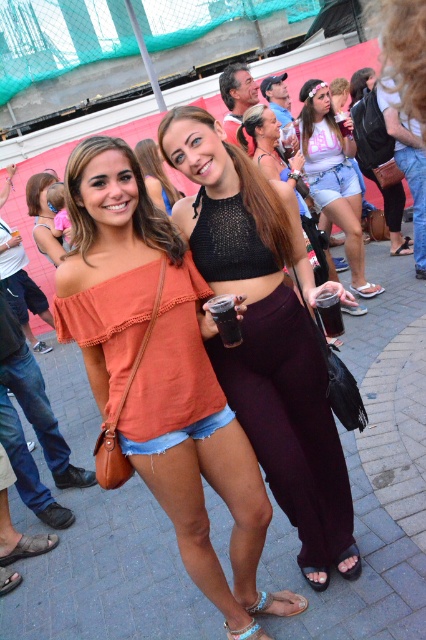
Question: Which of the following is the farthest from the observer?

Choices:
 (A) leather sandal at lower center
 (B) black mesh bikini top at center

Answer: (A)

Question: Which point is closer to the camera taking this photo?

Choices:
 (A) click(285, 609)
 (B) click(336, 170)

Answer: (A)

Question: Is matte black top at center bigger than black plastic cup at center?

Choices:
 (A) no
 (B) yes

Answer: (B)

Question: Is black mesh bikini top at center wider than leather sandal at lower center?

Choices:
 (A) yes
 (B) no

Answer: (A)

Question: Estimate the real-world distances between objects in this image. Which object is closer to the matte black top at center?

Choices:
 (A) dark matte glass at center
 (B) matte black top at upper left
 (C) orange cotton top at center

Answer: (B)

Question: Does matte black top at center appear on the left side of blue fabric sandal at lower center?

Choices:
 (A) yes
 (B) no

Answer: (A)